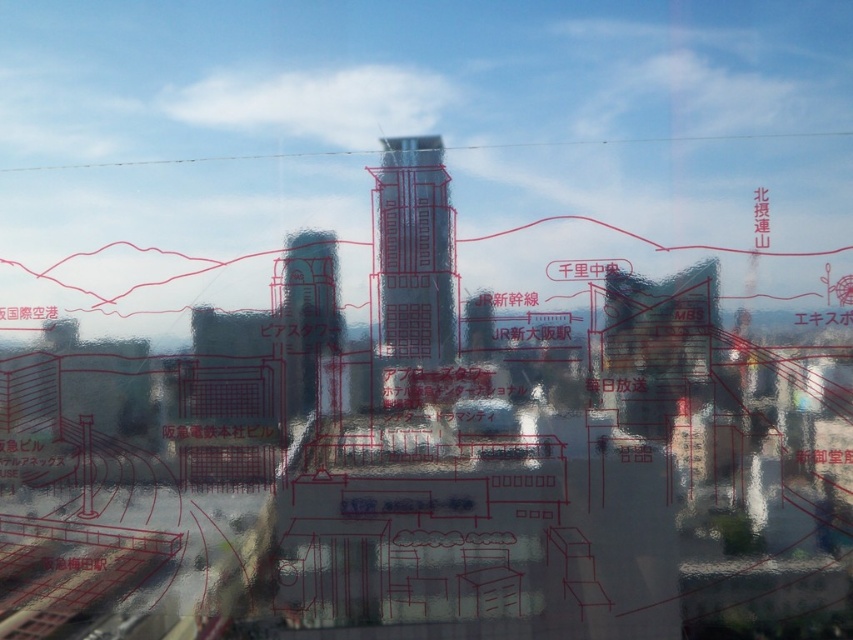
Is point (416, 355) closer to camera compared to point (289, 397)?

Yes, it is.

Identify the location of matte glass skyscraper at center. The height and width of the screenshot is (640, 853). (415, 252).